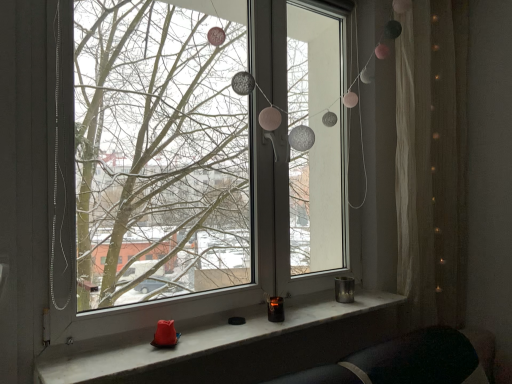
Question: Considering the relative sizes of white marble window sill at lower center and white sheer curtain at right in the image provided, is white marble window sill at lower center smaller than white sheer curtain at right?

Choices:
 (A) no
 (B) yes

Answer: (B)

Question: From the image's perspective, is white marble window sill at lower center located beneath white sheer curtain at right?

Choices:
 (A) no
 (B) yes

Answer: (B)

Question: Is white marble window sill at lower center facing towards white sheer curtain at right?

Choices:
 (A) yes
 (B) no

Answer: (B)

Question: Can you confirm if white marble window sill at lower center is shorter than white sheer curtain at right?

Choices:
 (A) no
 (B) yes

Answer: (B)

Question: Is the depth of white marble window sill at lower center greater than that of white sheer curtain at right?

Choices:
 (A) no
 (B) yes

Answer: (A)

Question: Considering the relative sizes of white marble window sill at lower center and white sheer curtain at right in the image provided, is white marble window sill at lower center thinner than white sheer curtain at right?

Choices:
 (A) yes
 (B) no

Answer: (B)

Question: Does white sheer curtain at right lie behind transparent glass window at center?

Choices:
 (A) yes
 (B) no

Answer: (A)

Question: Is white sheer curtain at right next to transparent glass window at center and touching it?

Choices:
 (A) no
 (B) yes

Answer: (A)

Question: Is white sheer curtain at right smaller than transparent glass window at center?

Choices:
 (A) no
 (B) yes

Answer: (B)

Question: Considering the relative sizes of white sheer curtain at right and transparent glass window at center in the image provided, is white sheer curtain at right wider than transparent glass window at center?

Choices:
 (A) no
 (B) yes

Answer: (B)

Question: Considering the relative sizes of white sheer curtain at right and transparent glass window at center in the image provided, is white sheer curtain at right taller than transparent glass window at center?

Choices:
 (A) no
 (B) yes

Answer: (B)

Question: Can you confirm if white sheer curtain at right is bigger than transparent glass window at center?

Choices:
 (A) yes
 (B) no

Answer: (B)

Question: Considering the relative positions of transparent glass window at center and white sheer curtain at right in the image provided, is transparent glass window at center to the right of white sheer curtain at right from the viewer's perspective?

Choices:
 (A) no
 (B) yes

Answer: (A)